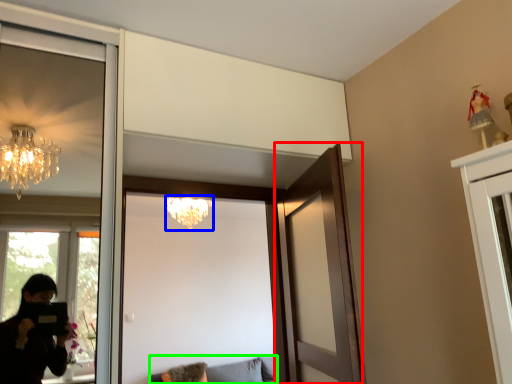
Question: Considering the real-world distances, which object is farthest from door (highlighted by a red box)? lamp (highlighted by a blue box) or furniture (highlighted by a green box)?

Choices:
 (A) lamp
 (B) furniture

Answer: (B)